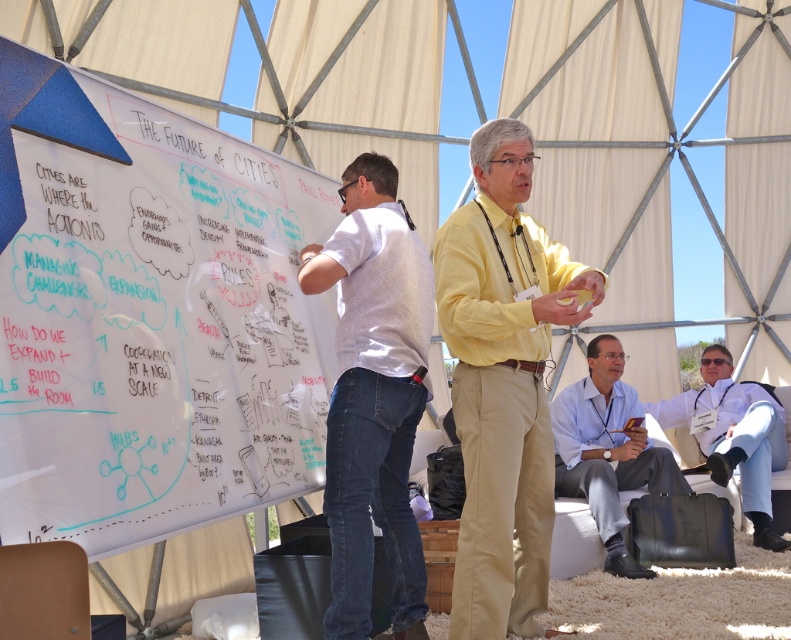
Looking at this image, you are attending a conference under a geodesic dome and notice two items on the left side of the scene. Which one is larger, the whiteboard at left or the white cotton shirt at left?

The whiteboard at left is bigger than the white cotton shirt at left.